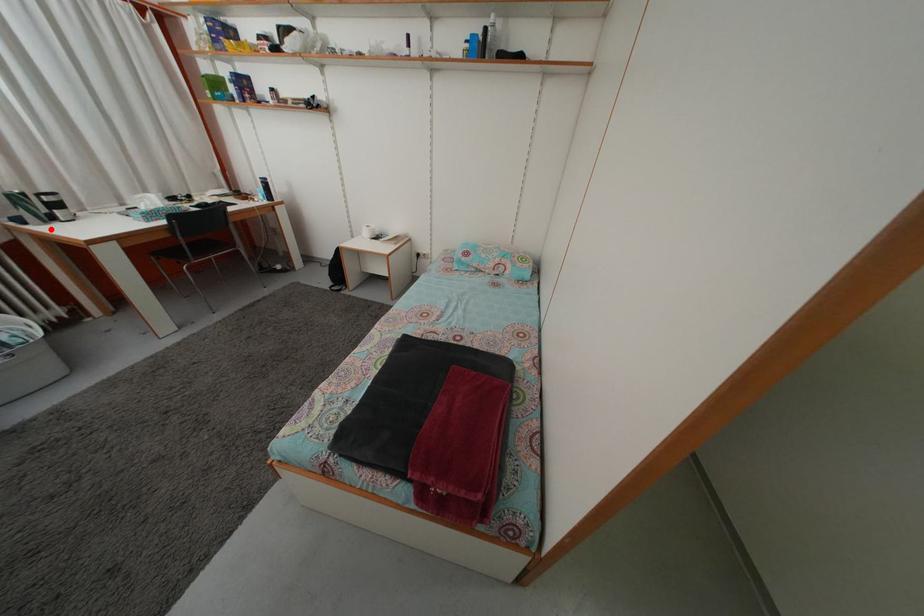
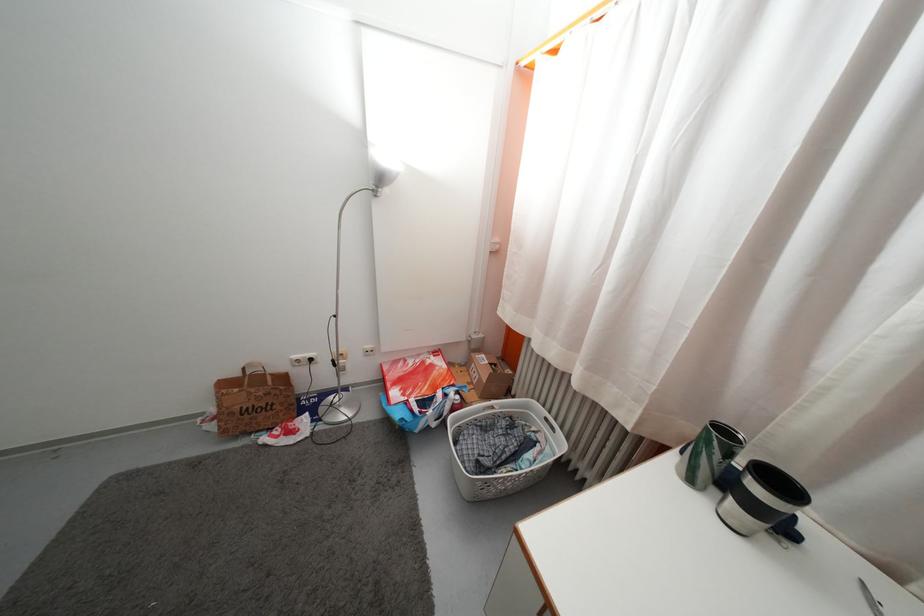
Question: I am providing you with two images of the same scene from different viewpoints. Given a red point in image1, look at the same physical point in image2. Is it:

Choices:
 (A) Closer to the viewpoint
 (B) Farther from the viewpoint

Answer: (A)